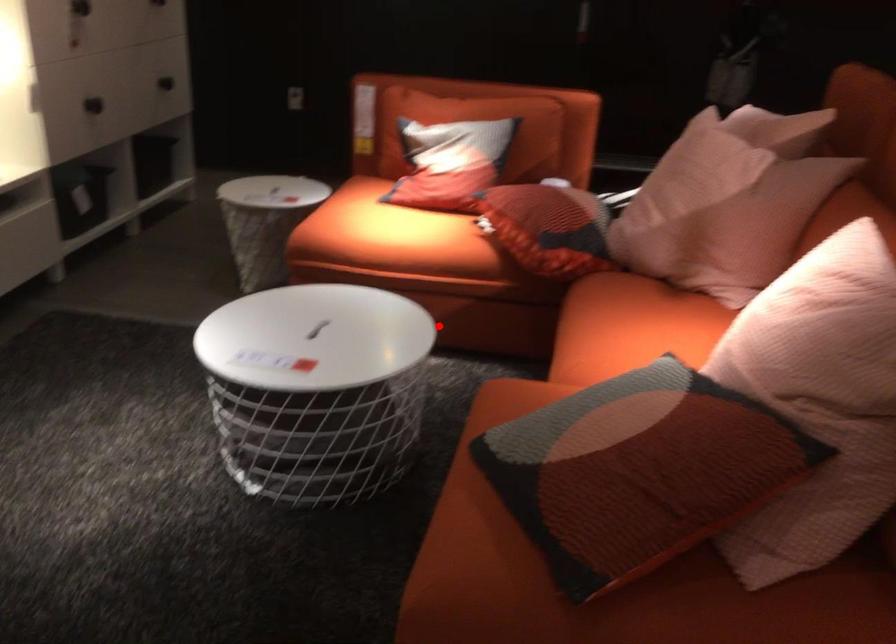
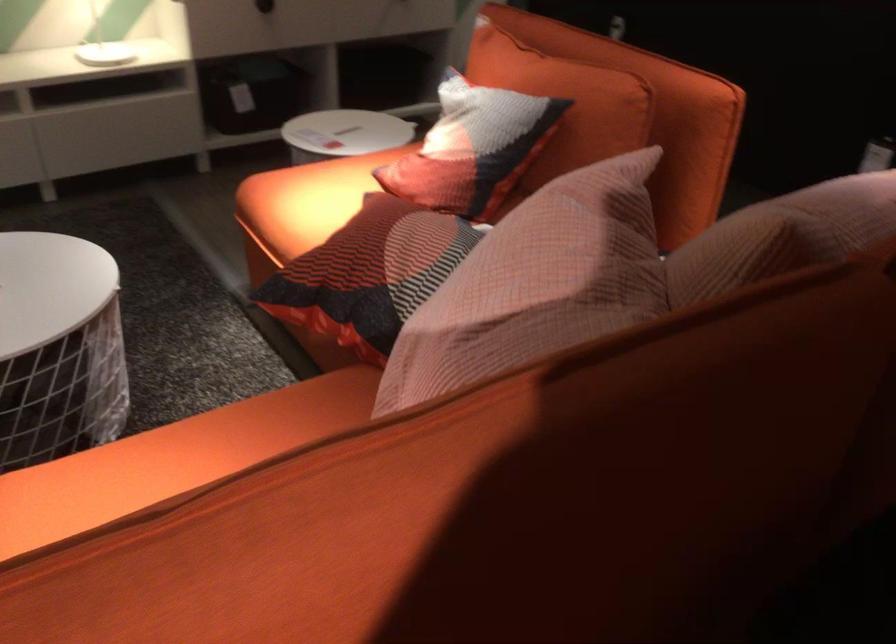
Question: I am providing you with two images of the same scene from different viewpoints. Image1 has a red point marked. In image2, the corresponding 3D location appears at what relative position? Reply with the corresponding letter.

Choices:
 (A) Closer
 (B) Farther

Answer: (A)